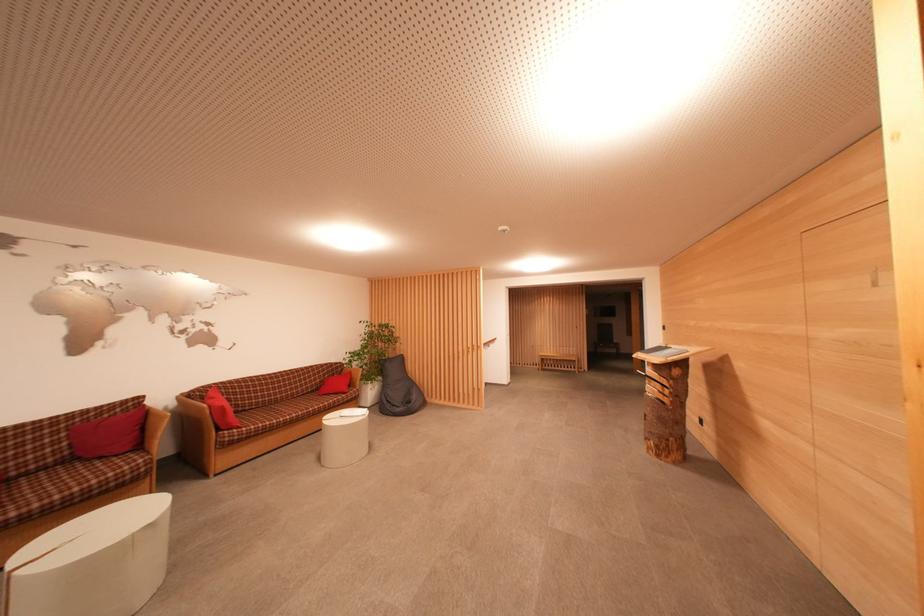
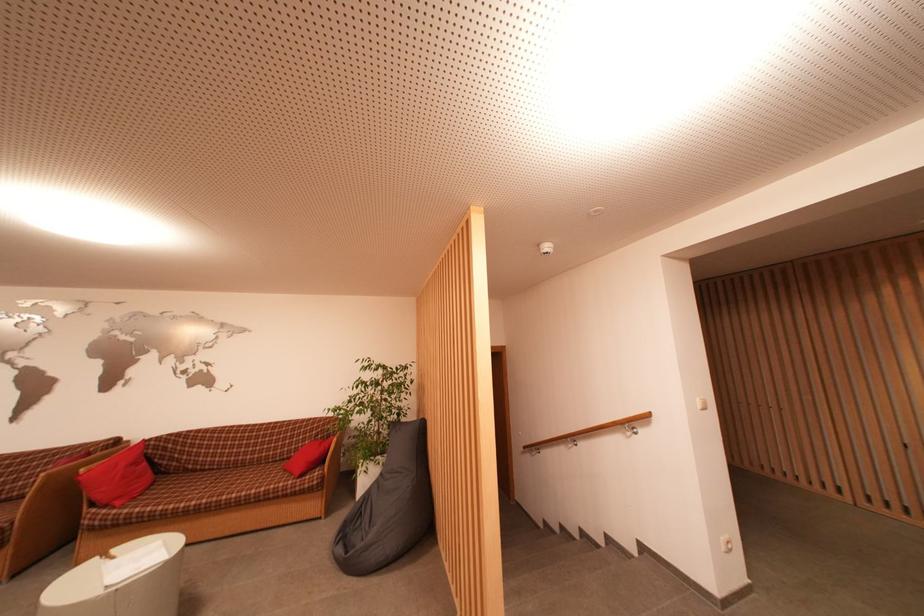
Where in the second image is the point corresponding to (337,378) from the first image?

(333, 439)